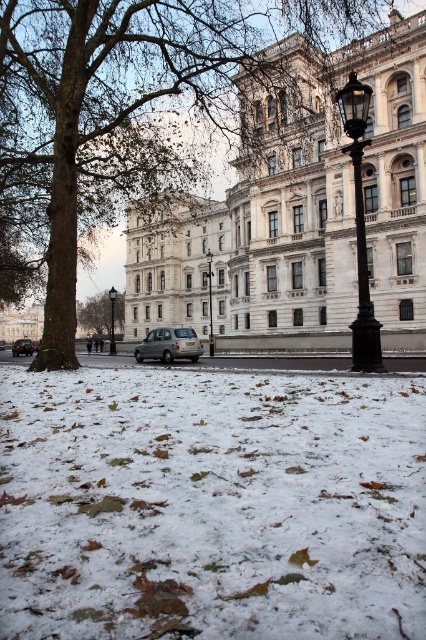
Who is higher up, white powdery snow at lower center or green leafy tree at center-left?

Positioned higher is green leafy tree at center-left.

Which is more to the right, white powdery snow at lower center or green leafy tree at center-left?

From the viewer's perspective, white powdery snow at lower center appears more on the right side.

Is point (131, 468) behind point (106, 308)?

No, (131, 468) is in front of (106, 308).

At what (x,y) coordinates should I click in order to perform the action: click on white powdery snow at lower center. Please return your answer as a coordinate pair (x, y). Image resolution: width=426 pixels, height=640 pixels. Looking at the image, I should click on (210, 506).

Who is positioned more to the right, silver metallic van at center or black polished lamp post at center?

From the viewer's perspective, black polished lamp post at center appears more on the right side.

How distant is silver metallic van at center from black polished lamp post at center?

silver metallic van at center is 30.30 meters from black polished lamp post at center.

Is point (186, 355) closer to camera compared to point (210, 262)?

Yes.

Where is `silver metallic van at center`? This screenshot has height=640, width=426. silver metallic van at center is located at coordinates (169, 344).

Between point (184, 628) and point (359, 193), which one is positioned in front?

Positioned in front is point (184, 628).

Between white powdery snow at lower center and polished brass lamp post at center-right, which one is positioned higher?

polished brass lamp post at center-right is higher up.

Measure the distance between point (51, 378) and camera.

64.76 meters

Where is `white powdery snow at lower center`? This screenshot has width=426, height=640. white powdery snow at lower center is located at coordinates (210, 506).